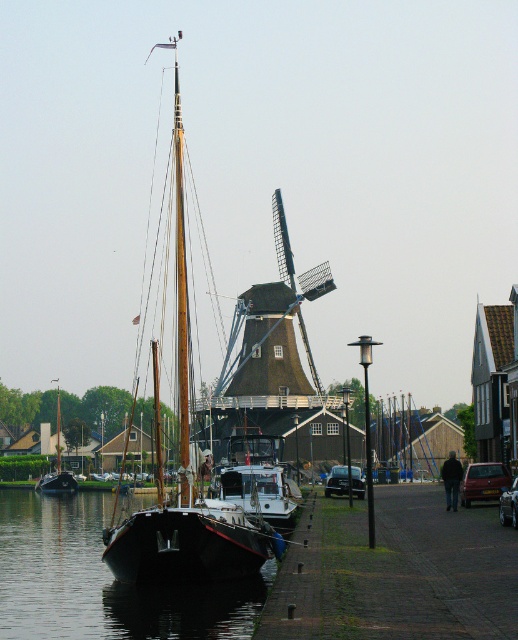
You are standing on the dock and see the black glossy water at lower left and the wooden sailboat at center. Which object is positioned lower in the scene?

The black glossy water at lower left is located below the wooden sailboat at center, so it is positioned lower in the scene.

You are a tour guide explaining the boats in the waterfront scene. You mention both the white matte boat at center and the wooden boat at left. Which boat is shorter?

The white matte boat at center is shorter than the wooden boat at left.